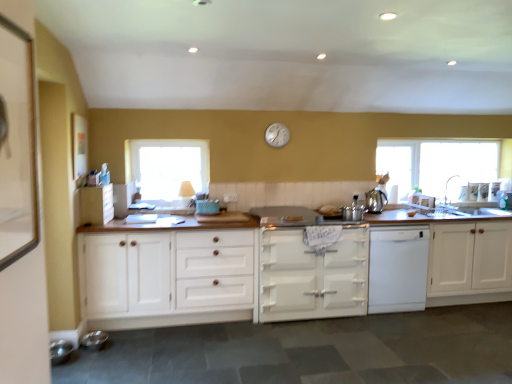
Image resolution: width=512 pixels, height=384 pixels. Find the location of `vacant area in front of shiny metallic kettle at right`. vacant area in front of shiny metallic kettle at right is located at coordinates (379, 210).